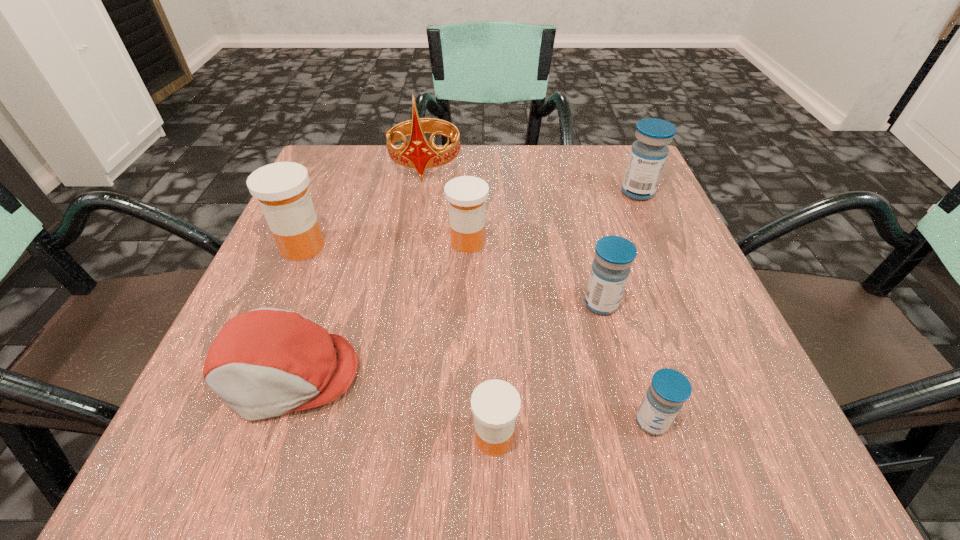
You are a GUI agent. You are given a task and a screenshot of the screen. Output one action in this format:
    pyautogui.click(x=<x>, y=<y>)
    Task: Click on the smallest blue medicine
    The image size is (960, 540).
    Given the screenshot: What is the action you would take?
    pyautogui.click(x=669, y=389)

What are the coordinates of `the smallest orange medicine` in the screenshot? It's located at (495, 404).

Where is `vacant area situated 0.280m on the front-facing side of the tallest object`? This screenshot has height=540, width=960. vacant area situated 0.280m on the front-facing side of the tallest object is located at coordinates (406, 276).

Where is `vacant space located on the front of the rightmost medicine`? This screenshot has width=960, height=540. vacant space located on the front of the rightmost medicine is located at coordinates (663, 251).

At what (x,y) coordinates should I click in order to perform the action: click on vacant region located 0.300m on the label of the leftmost orange medicine. Please return your answer as a coordinate pair (x, y). The width and height of the screenshot is (960, 540). Looking at the image, I should click on (489, 246).

Locate an element on the screen. vacant space located on the label of the second biggest orange medicine is located at coordinates (546, 242).

Locate an element on the screen. Image resolution: width=960 pixels, height=540 pixels. vacant space located 0.350m on the back of the second biggest blue medicine is located at coordinates (568, 177).

Locate an element on the screen. This screenshot has height=540, width=960. free space located 0.060m on the front-facing side of the red cap is located at coordinates (254, 471).

Identify the location of free region located on the back of the nearest blue medicine. (612, 284).

This screenshot has width=960, height=540. In order to click on tiara located at the far edge in this screenshot , I will do `click(420, 154)`.